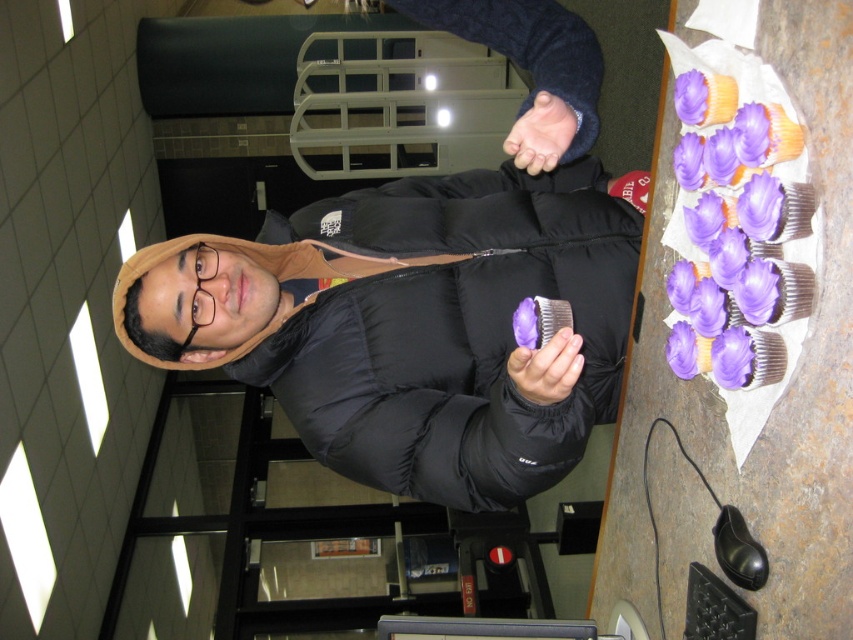
Question: Which point is closer to the camera?

Choices:
 (A) purple matte hand at center
 (B) black puffy jacket at center

Answer: (B)

Question: Is black puffy jacket at center wider than purple matte hand at center?

Choices:
 (A) no
 (B) yes

Answer: (B)

Question: Which object is positioned closest to the black puffy jacket at center?

Choices:
 (A) purple matte cupcake at center
 (B) purple matte hand at center

Answer: (B)

Question: Which point appears farthest from the camera in this image?

Choices:
 (A) (431, 472)
 (B) (561, 118)

Answer: (A)

Question: Can you confirm if black puffy jacket at center is positioned below purple matte hand at center?

Choices:
 (A) yes
 (B) no

Answer: (A)

Question: Is purple matte hand at center positioned at the back of purple matte cupcake at center?

Choices:
 (A) no
 (B) yes

Answer: (B)